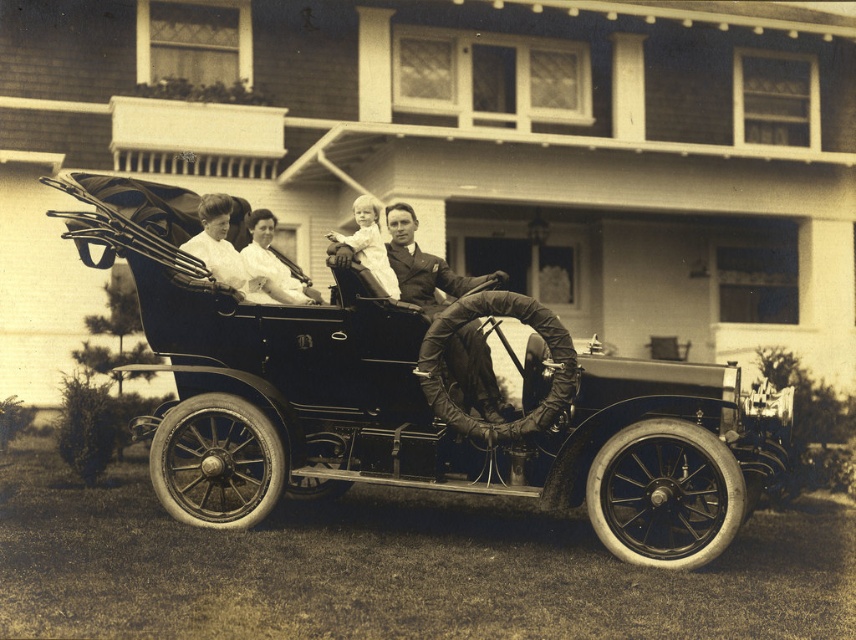
Question: Which point is closer to the camera?

Choices:
 (A) (376, 220)
 (B) (453, 340)
 (C) (272, 221)

Answer: (B)

Question: Considering the real-world distances, which object is farthest from the smooth white baby at center?

Choices:
 (A) polished wood car at center
 (B) smooth leather jacket at center

Answer: (A)

Question: Is polished wood car at center further to the viewer compared to smooth leather jacket at center?

Choices:
 (A) no
 (B) yes

Answer: (A)

Question: Does smooth leather jacket at center come in front of smooth white baby at center?

Choices:
 (A) no
 (B) yes

Answer: (A)

Question: Does smooth leather jacket at center lie behind smooth white dress at center?

Choices:
 (A) yes
 (B) no

Answer: (B)

Question: Which point is closer to the camera?

Choices:
 (A) (251, 216)
 (B) (385, 259)
 (C) (467, 276)
 (D) (174, 292)

Answer: (D)